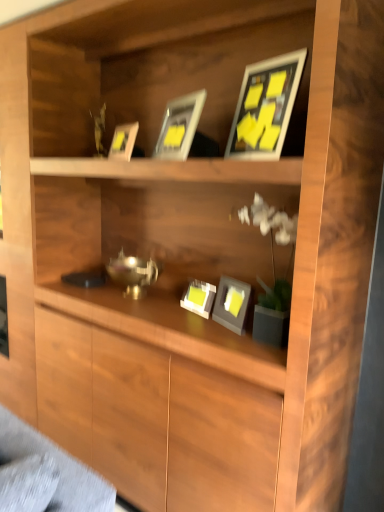
At what (x,y) coordinates should I click in order to perform the action: click on matte gray picture frame at center, which ranks as the second picture frame in bottom-to-top order. Please return your answer as a coordinate pair (x, y). Looking at the image, I should click on (231, 303).

Image resolution: width=384 pixels, height=512 pixels. What do you see at coordinates (265, 106) in the screenshot? I see `matte black picture frame at upper center, acting as the second picture frame starting from the top` at bounding box center [265, 106].

Looking at this image, how much space does matte black picture frame at upper center, positioned as the fourth picture frame in bottom-to-top order, occupy vertically?

It is 14.46 inches.

The width and height of the screenshot is (384, 512). Describe the element at coordinates (198, 298) in the screenshot. I see `matte gray picture frame at center, placed as the first picture frame when sorted from bottom to top` at that location.

Describe the element at coordinates (179, 126) in the screenshot. I see `matte silver picture frame at upper center, marked as the 5th picture frame in a bottom-to-top arrangement` at that location.

At what (x,y) coordinates should I click in order to perform the action: click on matte gray picture frame at center, which ranks as the second picture frame in bottom-to-top order. Please return your answer as a coordinate pair (x, y). Looking at the image, I should click on (231, 303).

Is matte gold picture frame at upper center, placed as the 3th picture frame when sorted from bottom to top, oriented towards matte silver picture frame at upper center, marked as the 5th picture frame in a bottom-to-top arrangement?

No, matte gold picture frame at upper center, placed as the 3th picture frame when sorted from bottom to top, is not oriented towards matte silver picture frame at upper center, marked as the 5th picture frame in a bottom-to-top arrangement.

This screenshot has width=384, height=512. What are the coordinates of `the 1st picture frame to the right of the matte gold picture frame at upper center, which appears as the third picture frame when viewed from the top, starting your count from the anchor` in the screenshot? It's located at (179, 126).

Can you tell me how much matte gold picture frame at upper center, which appears as the third picture frame when viewed from the top, and matte silver picture frame at upper center, marked as the 5th picture frame in a bottom-to-top arrangement, differ in facing direction?

matte gold picture frame at upper center, which appears as the third picture frame when viewed from the top, and matte silver picture frame at upper center, marked as the 5th picture frame in a bottom-to-top arrangement, are facing 5.22 degrees away from each other.

Who is shorter, matte gold picture frame at upper center, which appears as the third picture frame when viewed from the top, or matte silver picture frame at upper center, which is counted as the 1th picture frame, starting from the top?

Standing shorter between the two is matte gold picture frame at upper center, which appears as the third picture frame when viewed from the top.

From a real-world perspective, relative to matte gray picture frame at center, placed as the first picture frame when sorted from bottom to top, is matte gold picture frame at upper center, which appears as the third picture frame when viewed from the top, vertically above or below?

From a real-world perspective, matte gold picture frame at upper center, which appears as the third picture frame when viewed from the top, is physically above matte gray picture frame at center, placed as the first picture frame when sorted from bottom to top.

Is matte gold picture frame at upper center, placed as the 3th picture frame when sorted from bottom to top, further to the viewer compared to matte gray picture frame at center, which ranks as the fifth picture frame in top-to-bottom order?

Yes, matte gold picture frame at upper center, placed as the 3th picture frame when sorted from bottom to top, is behind matte gray picture frame at center, which ranks as the fifth picture frame in top-to-bottom order.

Is the surface of matte gold picture frame at upper center, which appears as the third picture frame when viewed from the top, in direct contact with matte gray picture frame at center, which ranks as the fifth picture frame in top-to-bottom order?

No, matte gold picture frame at upper center, which appears as the third picture frame when viewed from the top, is not next to matte gray picture frame at center, which ranks as the fifth picture frame in top-to-bottom order.

In terms of height, does matte gold picture frame at upper center, placed as the 3th picture frame when sorted from bottom to top, look taller or shorter compared to matte gray picture frame at center, placed as the first picture frame when sorted from bottom to top?

In the image, matte gold picture frame at upper center, placed as the 3th picture frame when sorted from bottom to top, appears to be taller than matte gray picture frame at center, placed as the first picture frame when sorted from bottom to top.

From the matte gold picture frame at upper center, placed as the 3th picture frame when sorted from bottom to top, count 1st picture frames forward and point to it. Please provide its 2D coordinates.

[(198, 298)]

Are matte gray picture frame at center, which ranks as the fifth picture frame in top-to-bottom order, and matte gold picture frame at upper center, placed as the 3th picture frame when sorted from bottom to top, beside each other?

No, matte gray picture frame at center, which ranks as the fifth picture frame in top-to-bottom order, is not next to matte gold picture frame at upper center, placed as the 3th picture frame when sorted from bottom to top.

From a real-world perspective, which is physically below, matte gray picture frame at center, which ranks as the fifth picture frame in top-to-bottom order, or matte gold picture frame at upper center, placed as the 3th picture frame when sorted from bottom to top?

In real-world perspective, matte gray picture frame at center, which ranks as the fifth picture frame in top-to-bottom order, is lower.

Is matte gray picture frame at center, placed as the first picture frame when sorted from bottom to top, further to camera compared to matte gray picture frame at center, which ranks as the second picture frame in bottom-to-top order?

Yes, it is behind matte gray picture frame at center, which ranks as the second picture frame in bottom-to-top order.

Is matte gray picture frame at center, which ranks as the fifth picture frame in top-to-bottom order, aimed at matte gray picture frame at center, the fourth picture frame from the top?

No.

Does matte gray picture frame at center, placed as the first picture frame when sorted from bottom to top, appear on the right side of matte gray picture frame at center, which ranks as the second picture frame in bottom-to-top order?

No, matte gray picture frame at center, placed as the first picture frame when sorted from bottom to top, is not to the right of matte gray picture frame at center, which ranks as the second picture frame in bottom-to-top order.

Can matte gray picture frame at center, the fourth picture frame from the top, be found inside matte gray picture frame at center, placed as the first picture frame when sorted from bottom to top?

No, matte gray picture frame at center, the fourth picture frame from the top, is located outside of matte gray picture frame at center, placed as the first picture frame when sorted from bottom to top.

From a real-world perspective, which object rests below the other?

In real-world perspective, matte gray picture frame at center, which ranks as the fifth picture frame in top-to-bottom order, is lower.

What are the coordinates of `the 1st picture frame to the left of the matte gray picture frame at center, which ranks as the fifth picture frame in top-to-bottom order, counting from the anchor's position` in the screenshot? It's located at (179, 126).

Is matte gray picture frame at center, which ranks as the fifth picture frame in top-to-bottom order, positioned with its back to matte silver picture frame at upper center, marked as the 5th picture frame in a bottom-to-top arrangement?

matte gray picture frame at center, which ranks as the fifth picture frame in top-to-bottom order, is not turned away from matte silver picture frame at upper center, marked as the 5th picture frame in a bottom-to-top arrangement.

Looking at their sizes, would you say matte gray picture frame at center, which ranks as the fifth picture frame in top-to-bottom order, is wider or thinner than matte silver picture frame at upper center, which is counted as the 1th picture frame, starting from the top?

Clearly, matte gray picture frame at center, which ranks as the fifth picture frame in top-to-bottom order, has less width compared to matte silver picture frame at upper center, which is counted as the 1th picture frame, starting from the top.

Is matte gold picture frame at upper center, placed as the 3th picture frame when sorted from bottom to top, positioned with its back to matte black picture frame at upper center, acting as the second picture frame starting from the top?

No, matte gold picture frame at upper center, placed as the 3th picture frame when sorted from bottom to top,'s orientation is not away from matte black picture frame at upper center, acting as the second picture frame starting from the top.

The width and height of the screenshot is (384, 512). Identify the location of picture frame that is the 4th object located in front of the matte gold picture frame at upper center, which appears as the third picture frame when viewed from the top. pos(265,106).

Is matte gold picture frame at upper center, placed as the 3th picture frame when sorted from bottom to top, not close to matte black picture frame at upper center, positioned as the fourth picture frame in bottom-to-top order?

No, matte gold picture frame at upper center, placed as the 3th picture frame when sorted from bottom to top, is in close proximity to matte black picture frame at upper center, positioned as the fourth picture frame in bottom-to-top order.

Considering the sizes of objects matte gold picture frame at upper center, placed as the 3th picture frame when sorted from bottom to top, and matte black picture frame at upper center, acting as the second picture frame starting from the top, in the image provided, who is smaller, matte gold picture frame at upper center, placed as the 3th picture frame when sorted from bottom to top, or matte black picture frame at upper center, acting as the second picture frame starting from the top,?

matte gold picture frame at upper center, placed as the 3th picture frame when sorted from bottom to top.

Is matte silver picture frame at upper center, which is counted as the 1th picture frame, starting from the top, oriented away from matte gold picture frame at upper center, which appears as the third picture frame when viewed from the top?

No, matte silver picture frame at upper center, which is counted as the 1th picture frame, starting from the top,'s orientation is not away from matte gold picture frame at upper center, which appears as the third picture frame when viewed from the top.

Is the depth of matte silver picture frame at upper center, which is counted as the 1th picture frame, starting from the top, less than that of matte gold picture frame at upper center, which appears as the third picture frame when viewed from the top?

Yes, matte silver picture frame at upper center, which is counted as the 1th picture frame, starting from the top, is closer to the viewer.

Considering the relative sizes of matte silver picture frame at upper center, marked as the 5th picture frame in a bottom-to-top arrangement, and matte gold picture frame at upper center, placed as the 3th picture frame when sorted from bottom to top, in the image provided, is matte silver picture frame at upper center, marked as the 5th picture frame in a bottom-to-top arrangement, wider than matte gold picture frame at upper center, placed as the 3th picture frame when sorted from bottom to top,?

Yes, matte silver picture frame at upper center, marked as the 5th picture frame in a bottom-to-top arrangement, is wider than matte gold picture frame at upper center, placed as the 3th picture frame when sorted from bottom to top.

How many degrees apart are the facing directions of matte silver picture frame at upper center, which is counted as the 1th picture frame, starting from the top, and matte gold picture frame at upper center, placed as the 3th picture frame when sorted from bottom to top?

5.22 degrees separate the facing orientations of matte silver picture frame at upper center, which is counted as the 1th picture frame, starting from the top, and matte gold picture frame at upper center, placed as the 3th picture frame when sorted from bottom to top.

Locate an element on the screen. The height and width of the screenshot is (512, 384). picture frame that is the 1st one below the matte silver picture frame at upper center, which is counted as the 1th picture frame, starting from the top (from a real-world perspective) is located at coordinates (123, 141).

Which picture frame is the 2nd one when counting from the right side of the matte gold picture frame at upper center, placed as the 3th picture frame when sorted from bottom to top? Please provide its 2D coordinates.

[(198, 298)]

Based on their spatial positions, is matte gray picture frame at center, the fourth picture frame from the top, or matte gray picture frame at center, which ranks as the fifth picture frame in top-to-bottom order, further from matte black picture frame at upper center, positioned as the fourth picture frame in bottom-to-top order?

Among the two, matte gray picture frame at center, which ranks as the fifth picture frame in top-to-bottom order, is located further to matte black picture frame at upper center, positioned as the fourth picture frame in bottom-to-top order.

Which object lies further to the anchor point matte gray picture frame at center, the fourth picture frame from the top, matte gold picture frame at upper center, placed as the 3th picture frame when sorted from bottom to top, or matte black picture frame at upper center, acting as the second picture frame starting from the top?

The object further to matte gray picture frame at center, the fourth picture frame from the top, is matte gold picture frame at upper center, placed as the 3th picture frame when sorted from bottom to top.

Considering their positions, is matte gray picture frame at center, placed as the first picture frame when sorted from bottom to top, positioned closer to matte silver picture frame at upper center, marked as the 5th picture frame in a bottom-to-top arrangement, than matte gold picture frame at upper center, which appears as the third picture frame when viewed from the top?

Based on the image, matte gold picture frame at upper center, which appears as the third picture frame when viewed from the top, appears to be nearer to matte silver picture frame at upper center, marked as the 5th picture frame in a bottom-to-top arrangement.

Considering their positions, is matte gray picture frame at center, which ranks as the fifth picture frame in top-to-bottom order, positioned further to matte gray picture frame at center, the fourth picture frame from the top, than matte silver picture frame at upper center, which is counted as the 1th picture frame, starting from the top?

matte silver picture frame at upper center, which is counted as the 1th picture frame, starting from the top, is positioned further to the anchor matte gray picture frame at center, the fourth picture frame from the top.

From the image, which object appears to be nearer to matte gray picture frame at center, which ranks as the fifth picture frame in top-to-bottom order, matte silver picture frame at upper center, marked as the 5th picture frame in a bottom-to-top arrangement, or matte gray picture frame at center, the fourth picture frame from the top?

Based on the image, matte gray picture frame at center, the fourth picture frame from the top, appears to be nearer to matte gray picture frame at center, which ranks as the fifth picture frame in top-to-bottom order.

Looking at the image, which one is located closer to matte black picture frame at upper center, positioned as the fourth picture frame in bottom-to-top order, matte gray picture frame at center, which ranks as the fifth picture frame in top-to-bottom order, or matte silver picture frame at upper center, which is counted as the 1th picture frame, starting from the top?

matte silver picture frame at upper center, which is counted as the 1th picture frame, starting from the top, is closer to matte black picture frame at upper center, positioned as the fourth picture frame in bottom-to-top order.

When comparing their distances from matte silver picture frame at upper center, which is counted as the 1th picture frame, starting from the top, does matte gray picture frame at center, which ranks as the second picture frame in bottom-to-top order, or matte gold picture frame at upper center, which appears as the third picture frame when viewed from the top, seem further?

Based on the image, matte gray picture frame at center, which ranks as the second picture frame in bottom-to-top order, appears to be further to matte silver picture frame at upper center, which is counted as the 1th picture frame, starting from the top.

From the image, which object appears to be farther from matte silver picture frame at upper center, marked as the 5th picture frame in a bottom-to-top arrangement, matte black picture frame at upper center, positioned as the fourth picture frame in bottom-to-top order, or matte gold picture frame at upper center, placed as the 3th picture frame when sorted from bottom to top?

matte gold picture frame at upper center, placed as the 3th picture frame when sorted from bottom to top, is further to matte silver picture frame at upper center, marked as the 5th picture frame in a bottom-to-top arrangement.

The height and width of the screenshot is (512, 384). Find the location of `picture frame between matte black picture frame at upper center, acting as the second picture frame starting from the top, and matte gray picture frame at center, the fourth picture frame from the top, vertically`. picture frame between matte black picture frame at upper center, acting as the second picture frame starting from the top, and matte gray picture frame at center, the fourth picture frame from the top, vertically is located at coordinates (123, 141).

The image size is (384, 512). In order to click on picture frame that lies between matte gold picture frame at upper center, which appears as the third picture frame when viewed from the top, and matte gray picture frame at center, placed as the first picture frame when sorted from bottom to top, from top to bottom in this screenshot , I will do `click(231, 303)`.